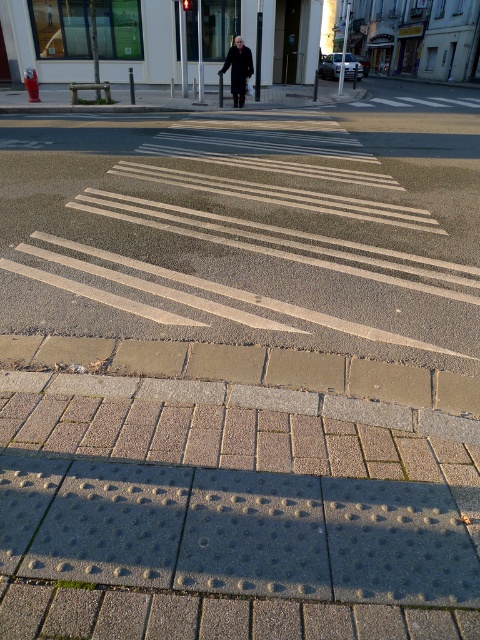
Who is shorter, white painted lines at center or dark gray wool coat at center?

dark gray wool coat at center is shorter.

Is white painted lines at center bigger than dark gray wool coat at center?

Correct, white painted lines at center is larger in size than dark gray wool coat at center.

The width and height of the screenshot is (480, 640). Find the location of `white painted lines at center`. white painted lines at center is located at coordinates (240, 232).

Is brick textured pavement at lower center bigger than white painted lines at center?

No, brick textured pavement at lower center is not bigger than white painted lines at center.

Can you confirm if brick textured pavement at lower center is positioned below white painted lines at center?

Yes.

Locate an element on the screen. Image resolution: width=480 pixels, height=640 pixels. brick textured pavement at lower center is located at coordinates 231,513.

Is point (66, 605) positioned before point (245, 45)?

Yes, point (66, 605) is closer to viewer.

Is brick textured pavement at lower center closer to camera compared to dark gray wool coat at center?

That is True.

Is point (34, 380) positioned before point (230, 60)?

Yes, point (34, 380) is in front of point (230, 60).

Where is `brick textured pavement at lower center`? The height and width of the screenshot is (640, 480). brick textured pavement at lower center is located at coordinates (231, 513).